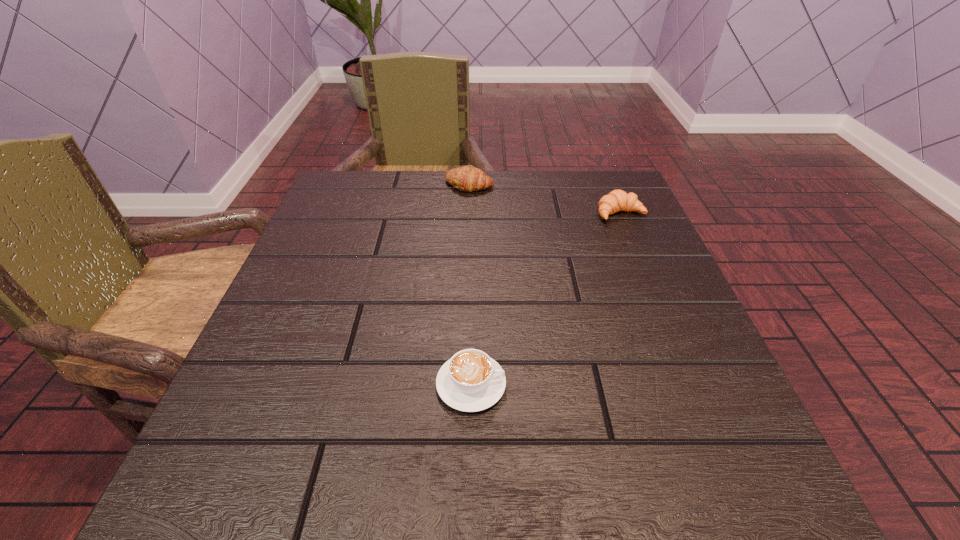
Where is `free region at the far edge of the desktop`? free region at the far edge of the desktop is located at coordinates (418, 178).

Locate an element on the screen. This screenshot has width=960, height=540. vacant space at the near edge is located at coordinates (609, 476).

Identify the location of vacant point at the left edge. The image size is (960, 540). (307, 309).

In the image, there is a desktop. Identify the location of vacant space at the right edge. (659, 394).

In the image, there is a desktop. Where is `free region at the far left corner`? This screenshot has width=960, height=540. free region at the far left corner is located at coordinates (341, 196).

Locate an element on the screen. free region at the near left corner of the desktop is located at coordinates (283, 474).

In the image, there is a desktop. At what (x,y) coordinates should I click in order to perform the action: click on vacant region at the far right corner. Please return your answer as a coordinate pair (x, y). The image size is (960, 540). Looking at the image, I should click on (593, 199).

The width and height of the screenshot is (960, 540). What are the coordinates of `free spot at the near right corner of the desktop` in the screenshot? It's located at (741, 455).

At what (x,y) coordinates should I click in order to perform the action: click on empty space between the second nearest object and the nearest object. Please return your answer as a coordinate pair (x, y). The height and width of the screenshot is (540, 960). Looking at the image, I should click on (545, 299).

At what (x,y) coordinates should I click in order to perform the action: click on free point between the nearer crescent roll and the farthest object. Please return your answer as a coordinate pair (x, y). This screenshot has width=960, height=540. Looking at the image, I should click on (545, 199).